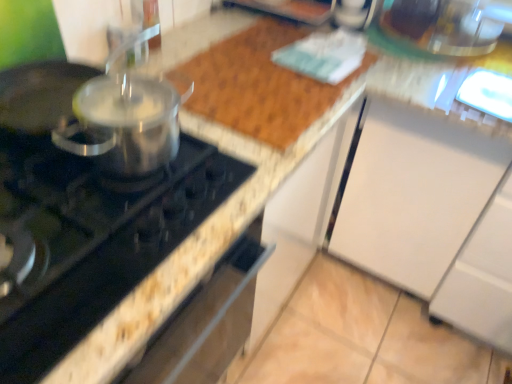
Image resolution: width=512 pixels, height=384 pixels. What do you see at coordinates (92, 239) in the screenshot? I see `black glass gas stove at left` at bounding box center [92, 239].

Identify the location of black glass gas stove at left. pos(92,239).

Describe the element at coordinates (127, 113) in the screenshot. I see `metallic silver pot at left` at that location.

This screenshot has width=512, height=384. I want to click on metallic silver pot at left, so click(127, 113).

What are the coordinates of `black glass gas stove at left` in the screenshot? It's located at (x=92, y=239).

Is metallic silver pot at left at the right side of black glass gas stove at left?

In fact, metallic silver pot at left is to the left of black glass gas stove at left.

Considering the relative positions of metallic silver pot at left and black glass gas stove at left in the image provided, is metallic silver pot at left behind black glass gas stove at left?

Yes.

Is point (160, 136) farther from viewer compared to point (87, 324)?

Yes, it is.

From the image's perspective, is metallic silver pot at left on top of black glass gas stove at left?

Yes, from the image's perspective, metallic silver pot at left is above black glass gas stove at left.

From a real-world perspective, which object rests below the other?

black glass gas stove at left, from a real-world perspective.

Between metallic silver pot at left and black glass gas stove at left, which one has smaller width?

Thinner between the two is metallic silver pot at left.

From their relative heights in the image, would you say metallic silver pot at left is taller or shorter than black glass gas stove at left?

Considering their sizes, metallic silver pot at left has more height than black glass gas stove at left.

Which of these two, metallic silver pot at left or black glass gas stove at left, is smaller?

metallic silver pot at left.

Would you say black glass gas stove at left is part of metallic silver pot at left's contents?

Actually, black glass gas stove at left is outside metallic silver pot at left.

Is metallic silver pot at left placed right next to black glass gas stove at left?

No, metallic silver pot at left is not making contact with black glass gas stove at left.

Is metallic silver pot at left facing away from black glass gas stove at left?

No, metallic silver pot at left is not facing away from black glass gas stove at left.

What's the angular difference between metallic silver pot at left and black glass gas stove at left's facing directions?

They differ by 0.253 degrees in their facing directions.

In the image, there is a metallic silver pot at left. Where is `gas stove below it (from a real-world perspective)`? gas stove below it (from a real-world perspective) is located at coordinates (92, 239).

Would you say black glass gas stove at left is to the left or to the right of metallic silver pot at left in the picture?

From the image, it's evident that black glass gas stove at left is to the right of metallic silver pot at left.

Which object is further away from the camera taking this photo, black glass gas stove at left or metallic silver pot at left?

metallic silver pot at left is more distant.

Is point (85, 249) positioned after point (76, 125)?

No, it is in front of (76, 125).

From the image's perspective, which one is positioned lower, black glass gas stove at left or metallic silver pot at left?

black glass gas stove at left is shown below in the image.

From a real-world perspective, is black glass gas stove at left beneath metallic silver pot at left?

Yes.

Considering the relative sizes of black glass gas stove at left and metallic silver pot at left in the image provided, is black glass gas stove at left thinner than metallic silver pot at left?

No, black glass gas stove at left is not thinner than metallic silver pot at left.

Considering the sizes of black glass gas stove at left and metallic silver pot at left in the image, is black glass gas stove at left taller or shorter than metallic silver pot at left?

black glass gas stove at left is shorter than metallic silver pot at left.

Considering the relative sizes of black glass gas stove at left and metallic silver pot at left in the image provided, is black glass gas stove at left smaller than metallic silver pot at left?

No, black glass gas stove at left is not smaller than metallic silver pot at left.

In the scene shown: Can we say black glass gas stove at left lies outside metallic silver pot at left?

black glass gas stove at left is positioned outside metallic silver pot at left.

Is black glass gas stove at left not near metallic silver pot at left?

Actually, black glass gas stove at left and metallic silver pot at left are a little close together.

Is black glass gas stove at left turned away from metallic silver pot at left?

No, black glass gas stove at left is not facing away from metallic silver pot at left.

What's the angular difference between black glass gas stove at left and metallic silver pot at left's facing directions?

0.253 degrees separate the facing orientations of black glass gas stove at left and metallic silver pot at left.

Measure the distance between black glass gas stove at left and metallic silver pot at left.

The distance of black glass gas stove at left from metallic silver pot at left is 5.62 inches.

Image resolution: width=512 pixels, height=384 pixels. Identify the location of gas stove below the metallic silver pot at left (from the image's perspective). (92, 239).

Locate an element on the screen. The width and height of the screenshot is (512, 384). kitchen appliance that appears on the left of black glass gas stove at left is located at coordinates (127, 113).

This screenshot has width=512, height=384. Identify the location of kitchen appliance behind the black glass gas stove at left. (127, 113).